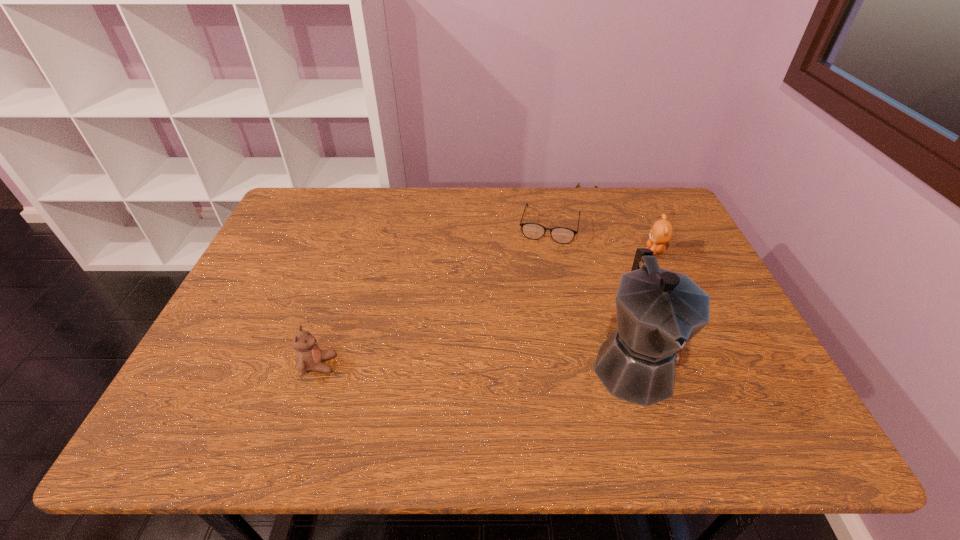
Locate an element on the screen. The height and width of the screenshot is (540, 960). vacant space on the desktop that is between the leftmost object and the coffeepot and is positioned on the front-facing side of the shortest object is located at coordinates (520, 364).

The height and width of the screenshot is (540, 960). I want to click on free space on the desktop that is between the left teddy bear and the tallest object and is positioned on the face of the rightmost object, so click(x=472, y=364).